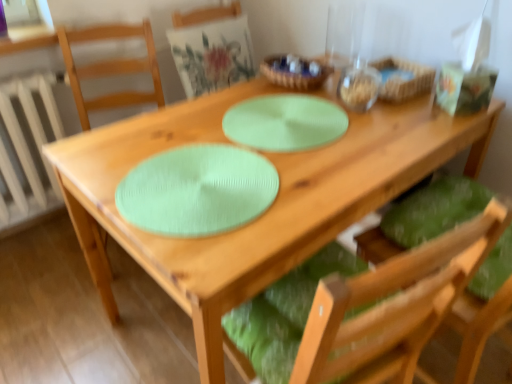
The height and width of the screenshot is (384, 512). I want to click on vacant area that lies to the right of mint green textured placemat at center, so 329,163.